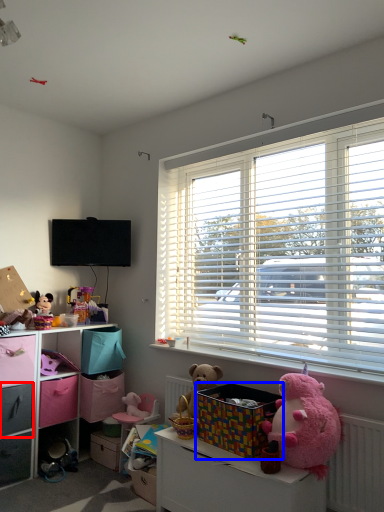
Question: Among these objects, which one is nearest to the camera, drawer (highlighted by a red box) or storage box (highlighted by a blue box)?

Choices:
 (A) drawer
 (B) storage box

Answer: (B)